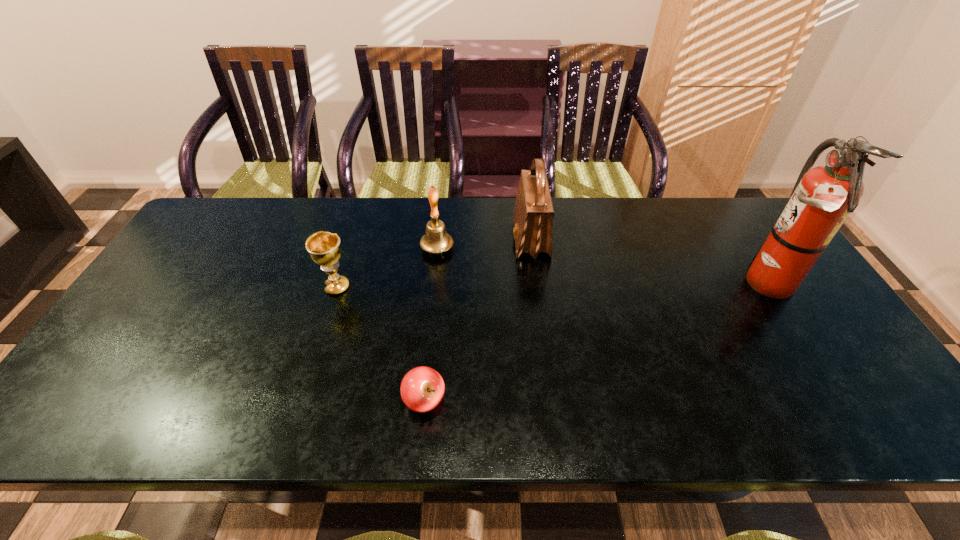
Find the location of a particular element. object that is at the near edge is located at coordinates (422, 388).

The image size is (960, 540). Find the location of `object that is at the right edge`. object that is at the right edge is located at coordinates (822, 198).

Locate an element on the screen. The image size is (960, 540). blank space at the far edge is located at coordinates (584, 201).

Locate an element on the screen. The image size is (960, 540). vacant position at the near edge of the desktop is located at coordinates (660, 406).

Locate an element on the screen. vacant space at the left edge of the desktop is located at coordinates (206, 293).

Where is `vacant region at the right edge of the desktop`? vacant region at the right edge of the desktop is located at coordinates pyautogui.click(x=796, y=308).

Identify the location of blank space at the near left corner of the desktop. tap(73, 431).

The height and width of the screenshot is (540, 960). I want to click on vacant region at the far right corner of the desktop, so click(743, 237).

Identify the location of free space between the tallest object and the second object from right to left. Image resolution: width=960 pixels, height=540 pixels. (647, 261).

The height and width of the screenshot is (540, 960). Find the location of `free space between the fourth tallest object and the rightmost object`. free space between the fourth tallest object and the rightmost object is located at coordinates (550, 285).